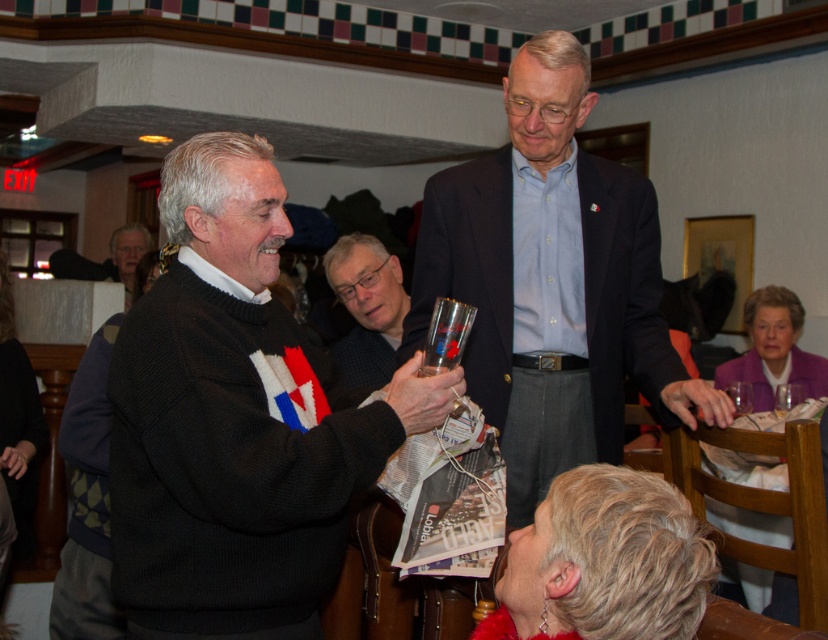
Does knitted sweater at center have a larger size compared to light blue button-down shirt at center?

Actually, knitted sweater at center might be smaller than light blue button-down shirt at center.

Measure the distance from knitted sweater at center to light blue button-down shirt at center.

A distance of 27.73 inches exists between knitted sweater at center and light blue button-down shirt at center.

Where is `knitted sweater at center`? This screenshot has width=828, height=640. knitted sweater at center is located at coordinates (237, 420).

Is knitted sweater at center further to camera compared to matte gray sweater at center?

No, it is not.

What are the coordinates of `knitted sweater at center` in the screenshot? It's located at (237, 420).

Who is higher up, light blue button-down shirt at center or matte gray sweater at center?

Positioned higher is light blue button-down shirt at center.

Who is more distant from viewer, (591, 173) or (348, 296)?

The point (348, 296) is behind.

I want to click on light blue button-down shirt at center, so click(551, 282).